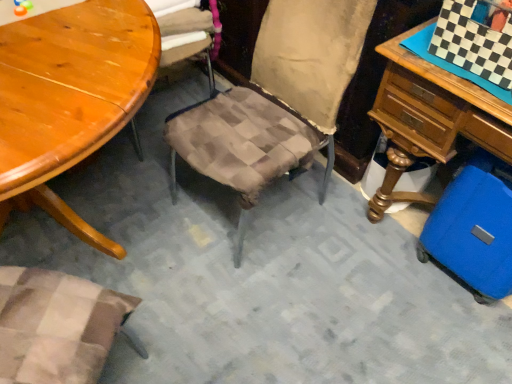
The image size is (512, 384). Find the location of `wooden table at upper left`. wooden table at upper left is located at coordinates (70, 98).

Describe the element at coordinates (70, 98) in the screenshot. I see `wooden table at upper left` at that location.

Describe the element at coordinates (474, 229) in the screenshot. This screenshot has height=384, width=512. I see `blue hardshell suitcase at lower right` at that location.

In order to face blue hardshell suitcase at lower right, should I rotate leftwards or rightwards?

You should rotate right by 29.185 degrees.

Find the location of a particular element. Image resolution: width=512 pixels, height=384 pixels. blue hardshell suitcase at lower right is located at coordinates (474, 229).

Where is `wooden table at upper left`? The width and height of the screenshot is (512, 384). wooden table at upper left is located at coordinates (70, 98).

Is wooden table at upper left to the left of blue hardshell suitcase at lower right from the viewer's perspective?

Indeed, wooden table at upper left is positioned on the left side of blue hardshell suitcase at lower right.

Considering the positions of objects wooden table at upper left and blue hardshell suitcase at lower right in the image provided, who is behind, wooden table at upper left or blue hardshell suitcase at lower right?

blue hardshell suitcase at lower right.

Is point (136, 51) closer or farther from the camera than point (505, 176)?

Point (136, 51) is closer to the camera than point (505, 176).

From the image's perspective, between wooden table at upper left and blue hardshell suitcase at lower right, which one is located above?

blue hardshell suitcase at lower right.

From a real-world perspective, is wooden table at upper left over blue hardshell suitcase at lower right?

Yes, from a real-world perspective, wooden table at upper left is above blue hardshell suitcase at lower right.

Between wooden table at upper left and blue hardshell suitcase at lower right, which one has larger width?

wooden table at upper left.

Considering the sizes of objects wooden table at upper left and blue hardshell suitcase at lower right in the image provided, who is taller, wooden table at upper left or blue hardshell suitcase at lower right?

wooden table at upper left.

Considering the relative sizes of wooden table at upper left and blue hardshell suitcase at lower right in the image provided, is wooden table at upper left bigger than blue hardshell suitcase at lower right?

Correct, wooden table at upper left is larger in size than blue hardshell suitcase at lower right.

Which is correct: wooden table at upper left is inside blue hardshell suitcase at lower right, or outside of it?

wooden table at upper left is outside blue hardshell suitcase at lower right.

Is there a large distance between wooden table at upper left and blue hardshell suitcase at lower right?

That's right, there is a large distance between wooden table at upper left and blue hardshell suitcase at lower right.

Could you tell me if wooden table at upper left is turned towards blue hardshell suitcase at lower right?

No, wooden table at upper left does not turn towards blue hardshell suitcase at lower right.

Can you tell me how much wooden table at upper left and blue hardshell suitcase at lower right differ in facing direction?

There is a 112-degree angle between the facing directions of wooden table at upper left and blue hardshell suitcase at lower right.

Where is `table in front of the blue hardshell suitcase at lower right`? The width and height of the screenshot is (512, 384). table in front of the blue hardshell suitcase at lower right is located at coordinates coord(70,98).

Can you confirm if blue hardshell suitcase at lower right is positioned to the left of wooden table at upper left?

In fact, blue hardshell suitcase at lower right is to the right of wooden table at upper left.

Which is behind, blue hardshell suitcase at lower right or wooden table at upper left?

Positioned behind is blue hardshell suitcase at lower right.

Is point (438, 201) closer or farther from the camera than point (5, 188)?

Point (438, 201) appears to be farther away from the viewer than point (5, 188).

From the image's perspective, who appears lower, blue hardshell suitcase at lower right or wooden table at upper left?

wooden table at upper left, from the image's perspective.

From a real-world perspective, is blue hardshell suitcase at lower right physically below wooden table at upper left?

Yes, from a real-world perspective, blue hardshell suitcase at lower right is below wooden table at upper left.

Which object is thinner, blue hardshell suitcase at lower right or wooden table at upper left?

With smaller width is blue hardshell suitcase at lower right.

Considering the sizes of objects blue hardshell suitcase at lower right and wooden table at upper left in the image provided, who is taller, blue hardshell suitcase at lower right or wooden table at upper left?

wooden table at upper left is taller.

Is blue hardshell suitcase at lower right bigger or smaller than wooden table at upper left?

blue hardshell suitcase at lower right is smaller than wooden table at upper left.

Does blue hardshell suitcase at lower right contain wooden table at upper left?

No, wooden table at upper left is not inside blue hardshell suitcase at lower right.

Can you see blue hardshell suitcase at lower right touching wooden table at upper left?

No, blue hardshell suitcase at lower right is not beside wooden table at upper left.

Could you tell me if blue hardshell suitcase at lower right is facing wooden table at upper left?

No, blue hardshell suitcase at lower right is not oriented towards wooden table at upper left.

This screenshot has width=512, height=384. Find the location of `luggage that appears on the right of wooden table at upper left`. luggage that appears on the right of wooden table at upper left is located at coordinates (474, 229).

Locate an element on the screen. The width and height of the screenshot is (512, 384). table to the left of blue hardshell suitcase at lower right is located at coordinates (70, 98).

At what (x,y) coordinates should I click in order to perform the action: click on luggage above the wooden table at upper left (from the image's perspective). Please return your answer as a coordinate pair (x, y). Looking at the image, I should click on (474, 229).